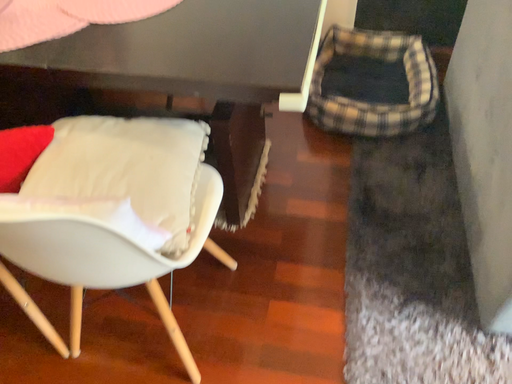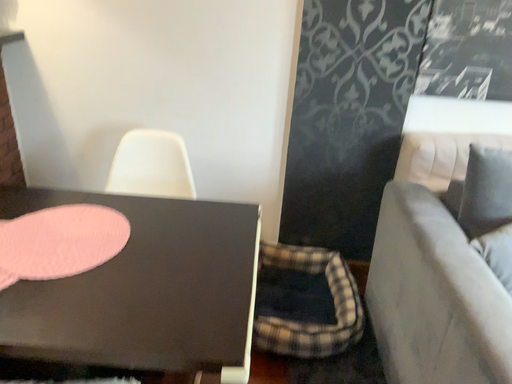
Question: Which way did the camera rotate in the video?

Choices:
 (A) rotated right
 (B) rotated left

Answer: (A)